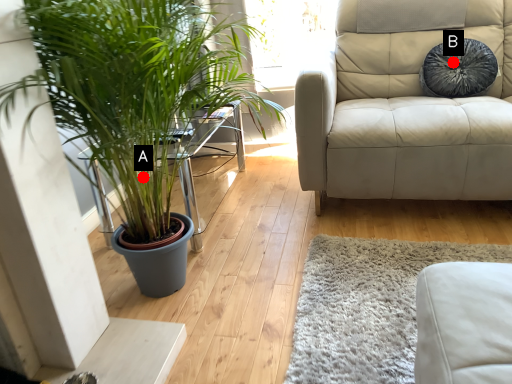
Question: Two points are circled on the image, labeled by A and B beside each circle. Which point appears closest to the camera in this image?

Choices:
 (A) A is closer
 (B) B is closer

Answer: (A)